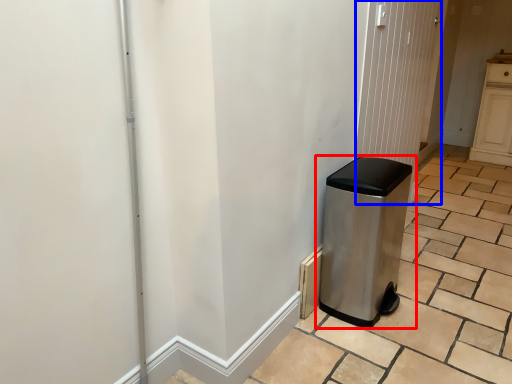
Question: Which of the following is the farthest to the observer, waste container (highlighted by a red box) or screen door (highlighted by a blue box)?

Choices:
 (A) waste container
 (B) screen door

Answer: (B)